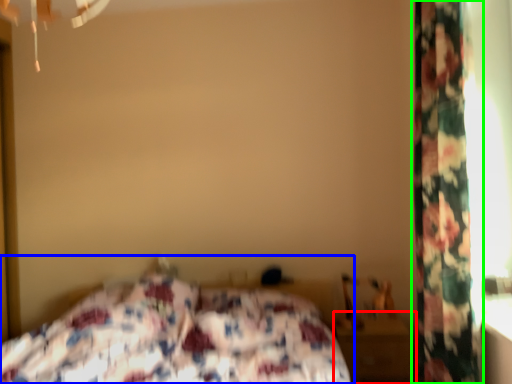
Question: Which is farther away from nightstand (highlighted by a red box)? bed (highlighted by a blue box) or curtain (highlighted by a green box)?

Choices:
 (A) bed
 (B) curtain

Answer: (B)